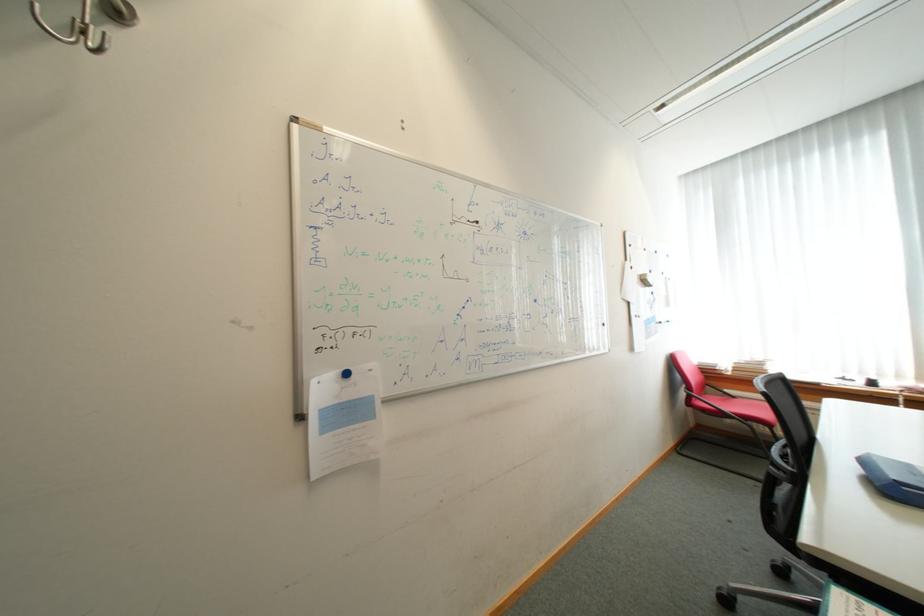
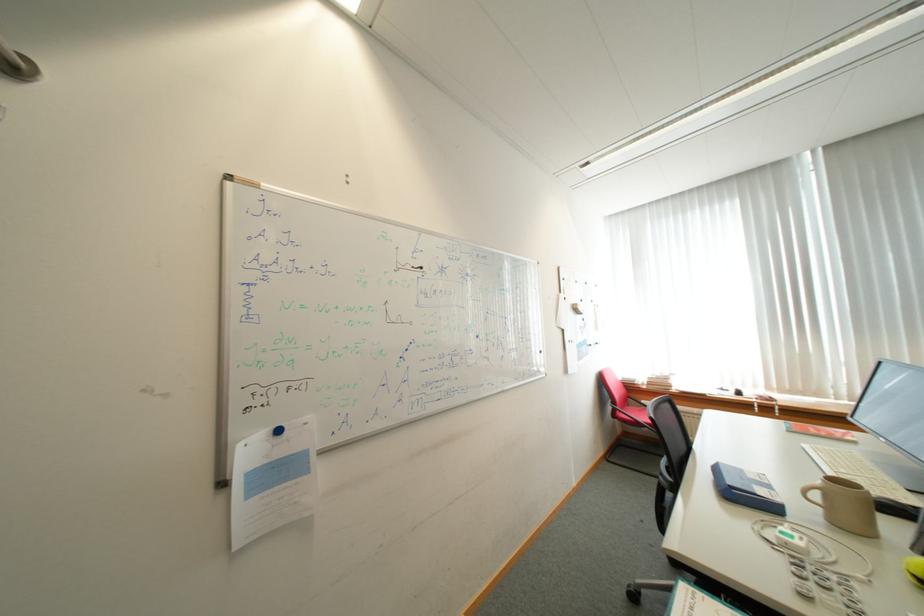
Question: The images are taken continuously from a first-person perspective. In which direction is your viewpoint rotating?

Choices:
 (A) Left
 (B) Right
 (C) Up
 (D) Down

Answer: (B)